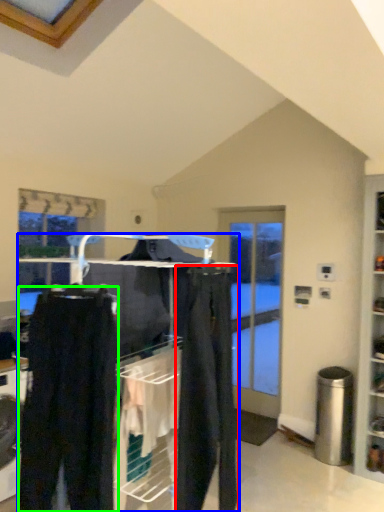
Question: Considering the real-world distances, which object is farthest from clothing (highlighted by a red box)? closet (highlighted by a blue box) or trousers (highlighted by a green box)?

Choices:
 (A) closet
 (B) trousers

Answer: (B)